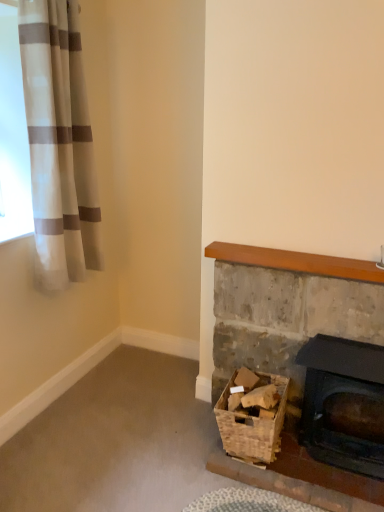
Question: Is white striped fabric at upper left completely or partially outside of woven brown basket at lower right?

Choices:
 (A) yes
 (B) no

Answer: (A)

Question: Is white striped fabric at upper left beside woven brown basket at lower right?

Choices:
 (A) yes
 (B) no

Answer: (B)

Question: Considering the relative sizes of white striped fabric at upper left and woven brown basket at lower right in the image provided, is white striped fabric at upper left wider than woven brown basket at lower right?

Choices:
 (A) yes
 (B) no

Answer: (B)

Question: From a real-world perspective, is white striped fabric at upper left under woven brown basket at lower right?

Choices:
 (A) yes
 (B) no

Answer: (B)

Question: Is white striped fabric at upper left closer to camera compared to woven brown basket at lower right?

Choices:
 (A) yes
 (B) no

Answer: (A)

Question: From a real-world perspective, is woven brown basket at lower right above or below white striped fabric at upper left?

Choices:
 (A) above
 (B) below

Answer: (B)

Question: Is woven brown basket at lower right spatially inside white striped fabric at upper left, or outside of it?

Choices:
 (A) outside
 (B) inside

Answer: (A)

Question: Looking at their shapes, would you say woven brown basket at lower right is wider or thinner than white striped fabric at upper left?

Choices:
 (A) thin
 (B) wide

Answer: (B)

Question: Would you say woven brown basket at lower right is to the left or to the right of white striped fabric at upper left in the picture?

Choices:
 (A) right
 (B) left

Answer: (A)

Question: Is rustic stone fireplace at lower right, marked as the second fireplace in a right-to-left arrangement, taller or shorter than matte black fireplace at lower right, the first fireplace in the right-to-left sequence?

Choices:
 (A) tall
 (B) short

Answer: (A)

Question: Considering the positions of rustic stone fireplace at lower right, marked as the second fireplace in a right-to-left arrangement, and matte black fireplace at lower right, the first fireplace in the right-to-left sequence, in the image, is rustic stone fireplace at lower right, marked as the second fireplace in a right-to-left arrangement, bigger or smaller than matte black fireplace at lower right, the first fireplace in the right-to-left sequence,?

Choices:
 (A) small
 (B) big

Answer: (B)

Question: From a real-world perspective, is rustic stone fireplace at lower right, marked as the second fireplace in a right-to-left arrangement, above or below matte black fireplace at lower right, the first fireplace in the right-to-left sequence?

Choices:
 (A) above
 (B) below

Answer: (A)

Question: Is rustic stone fireplace at lower right, marked as the second fireplace in a right-to-left arrangement, in front of or behind matte black fireplace at lower right, the first fireplace in the right-to-left sequence, in the image?

Choices:
 (A) behind
 (B) front

Answer: (A)

Question: Considering the positions of point (223, 388) and point (220, 385), is point (223, 388) closer or farther from the camera than point (220, 385)?

Choices:
 (A) farther
 (B) closer

Answer: (B)

Question: Looking at their shapes, would you say woven brown basket at lower right is wider or thinner than rustic stone fireplace at lower right, which is the 1th fireplace from left to right?

Choices:
 (A) wide
 (B) thin

Answer: (A)